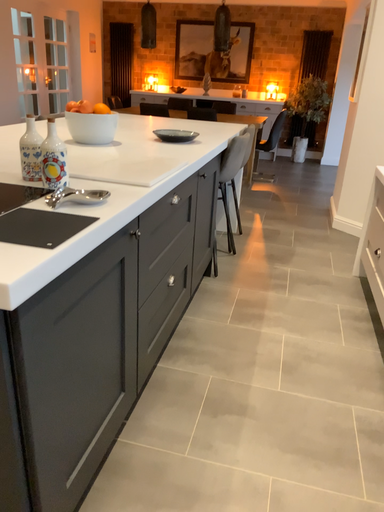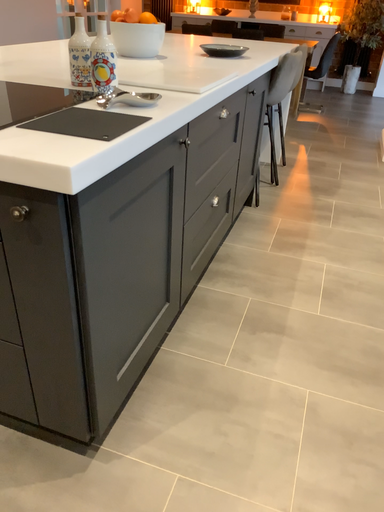
Question: How did the camera likely rotate when shooting the video?

Choices:
 (A) rotated upward
 (B) rotated downward

Answer: (B)